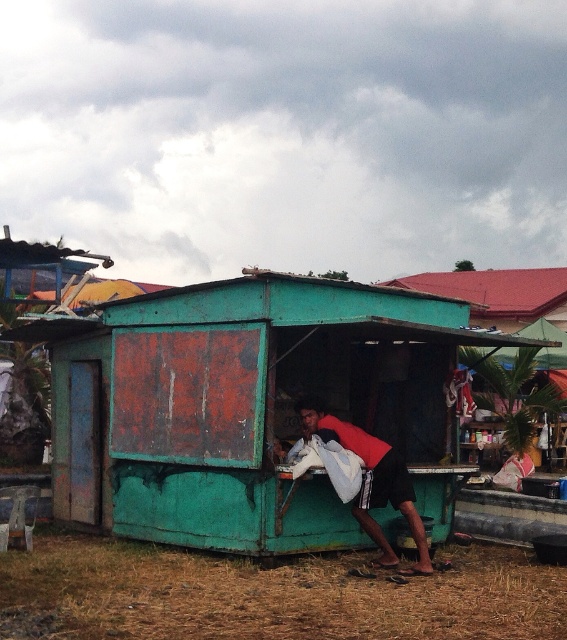
You are standing in front of the rusty metal shack at center and the orange fabric shirt at center. Which object is positioned more to the left?

The rusty metal shack at center is positioned to the left of the orange fabric shirt at center.

You are standing in front of the rusty metal shack at center and want to hand a document to the person wearing the orange fabric shirt at center. Can you place the document directly on the ground between the two objects without it being blocked by either?

The rusty metal shack at center is above the orange fabric shirt at center, so placing the document on the ground between them would not be blocked by either object since the shack is elevated and the shirt is at ground level.